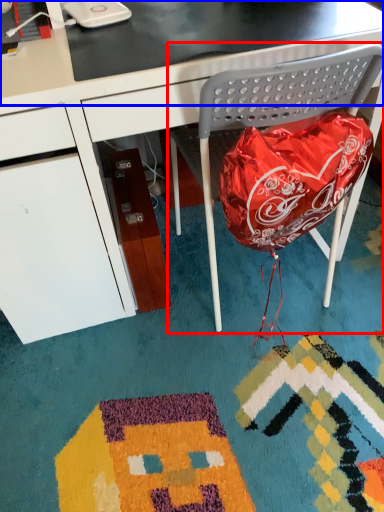
Question: Which of the following is the farthest to the observer, folding chair (highlighted by a red box) or table top (highlighted by a blue box)?

Choices:
 (A) folding chair
 (B) table top

Answer: (B)